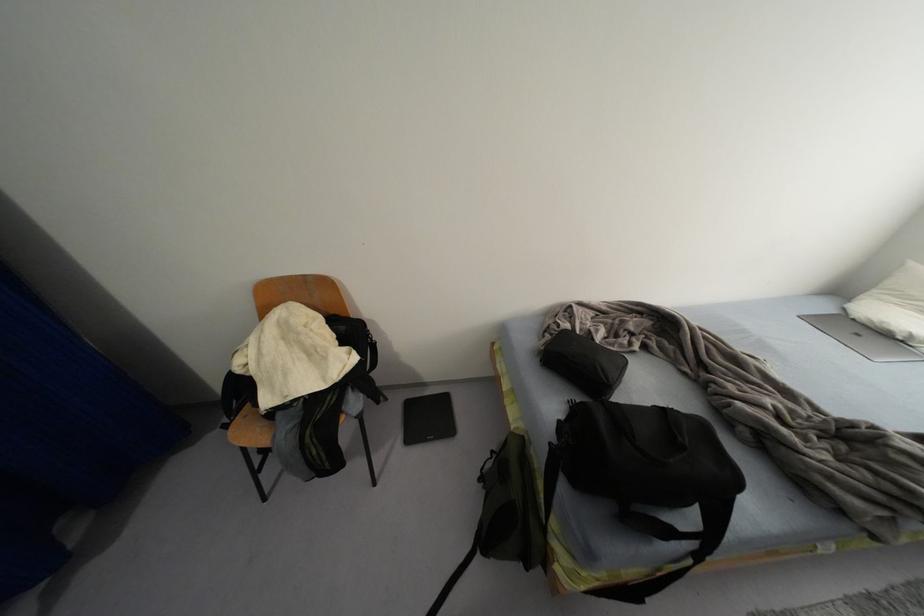
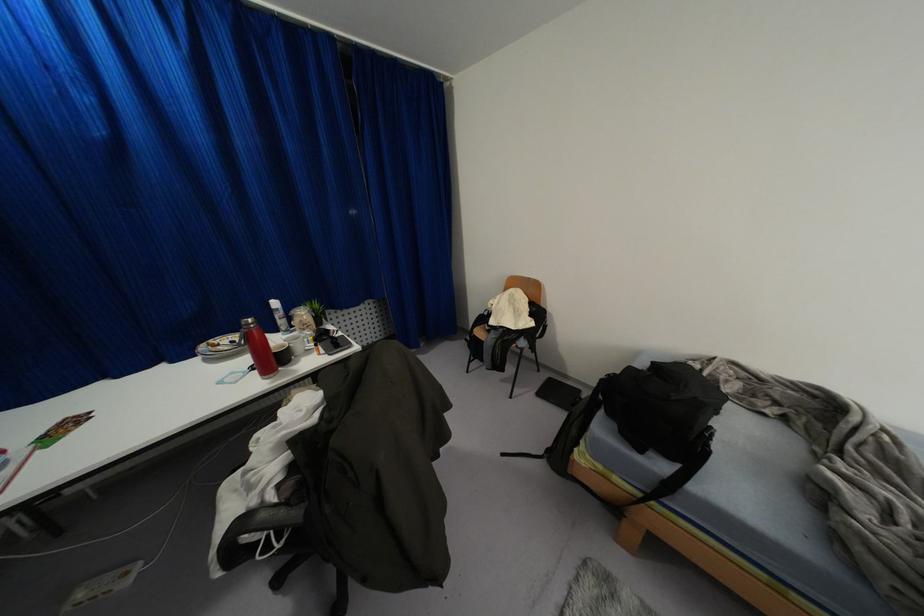
Question: The camera is either moving clockwise (left) or counter-clockwise (right) around the object. The first image is from the beginning of the video and the second image is from the end. Is the camera moving left or right when shooting the video?

Choices:
 (A) Left
 (B) Right

Answer: (B)